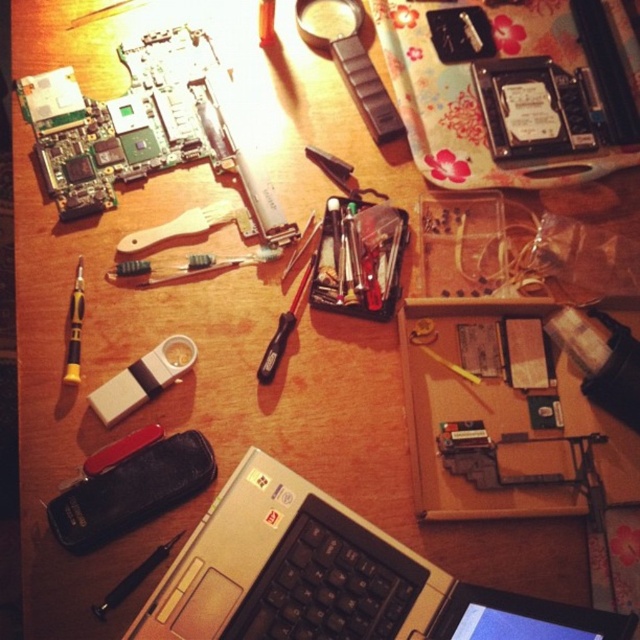
Does wooden-handled screwdriver at center-left have a greater height compared to translucent plastic ruler at center?

Indeed, wooden-handled screwdriver at center-left has a greater height compared to translucent plastic ruler at center.

Is wooden-handled screwdriver at center-left to the right of translucent plastic ruler at center from the viewer's perspective?

In fact, wooden-handled screwdriver at center-left is to the left of translucent plastic ruler at center.

Who is more distant from viewer, (202,220) or (268,17)?

The point (268,17) is more distant.

Image resolution: width=640 pixels, height=640 pixels. In order to click on wooden-handled screwdriver at center-left in this screenshot , I will do `click(189, 225)`.

Is silver metallic resistor at center below gold-plated screwdriver at left?

Incorrect, silver metallic resistor at center is not positioned below gold-plated screwdriver at left.

This screenshot has width=640, height=640. Describe the element at coordinates (186, 266) in the screenshot. I see `silver metallic resistor at center` at that location.

Identify the location of silver metallic resistor at center. The width and height of the screenshot is (640, 640). (186, 266).

Is white plastic usb flash drive at center-left smaller than silver metallic resistor at center?

No, white plastic usb flash drive at center-left is not smaller than silver metallic resistor at center.

Can you confirm if white plastic usb flash drive at center-left is thinner than silver metallic resistor at center?

Indeed, white plastic usb flash drive at center-left has a lesser width compared to silver metallic resistor at center.

Is point (173, 355) closer to camera compared to point (212, 259)?

Yes.

Locate an element on the screen. This screenshot has height=640, width=640. white plastic usb flash drive at center-left is located at coordinates (144, 378).